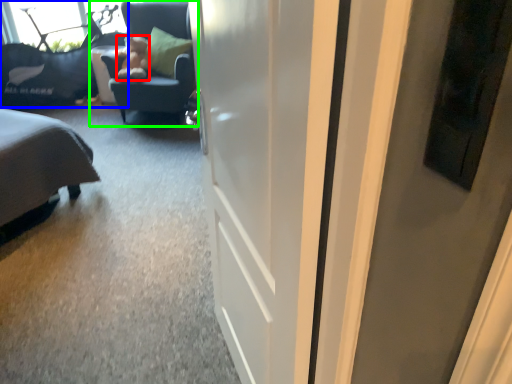
Question: Considering the real-world distances, which object is closest to teddy (highlighted by a red box)? furniture (highlighted by a blue box) or chair (highlighted by a green box).

Choices:
 (A) furniture
 (B) chair

Answer: (B)